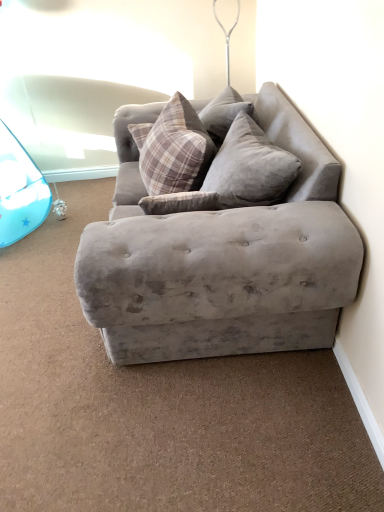
This screenshot has width=384, height=512. Describe the element at coordinates (250, 168) in the screenshot. I see `velvet gray pillow at center, acting as the second pillow starting from the left` at that location.

The image size is (384, 512). What do you see at coordinates (176, 150) in the screenshot?
I see `plaid fabric pillow at upper center, the first pillow from the left` at bounding box center [176, 150].

Locate an element on the screen. The height and width of the screenshot is (512, 384). velvet gray pillow at center, acting as the second pillow starting from the left is located at coordinates (250, 168).

Does velvet gray pillow at center, acting as the second pillow starting from the left, lie in front of plaid fabric pillow at upper center, the first pillow from the left?

Yes, it is in front of plaid fabric pillow at upper center, the first pillow from the left.

Visually, is velvet gray pillow at center, acting as the second pillow starting from the left, positioned to the left or to the right of plaid fabric pillow at upper center, which ranks as the 2th pillow in right-to-left order?

velvet gray pillow at center, acting as the second pillow starting from the left, is to the right of plaid fabric pillow at upper center, which ranks as the 2th pillow in right-to-left order.

Is velvet gray pillow at center, positioned as the first pillow in right-to-left order, looking in the opposite direction of plaid fabric pillow at upper center, which ranks as the 2th pillow in right-to-left order?

No.

Are velvet gray pillow at center, acting as the second pillow starting from the left, and plaid fabric pillow at upper center, which ranks as the 2th pillow in right-to-left order, making contact?

velvet gray pillow at center, acting as the second pillow starting from the left, and plaid fabric pillow at upper center, which ranks as the 2th pillow in right-to-left order, are not in contact.

Considering the relative positions of velvet gray pillow at center, acting as the second pillow starting from the left, and velvet gray couch at center in the image provided, is velvet gray pillow at center, acting as the second pillow starting from the left, behind velvet gray couch at center?

Yes, it is behind velvet gray couch at center.

Which of these two, velvet gray pillow at center, positioned as the first pillow in right-to-left order, or velvet gray couch at center, is wider?

With larger width is velvet gray couch at center.

How different are the orientations of velvet gray pillow at center, acting as the second pillow starting from the left, and velvet gray couch at center in degrees?

There is a 3.6-degree angle between the facing directions of velvet gray pillow at center, acting as the second pillow starting from the left, and velvet gray couch at center.

How far apart are velvet gray pillow at center, positioned as the first pillow in right-to-left order, and velvet gray couch at center?

10.79 inches.

Is velvet gray couch at center wider or thinner than plaid fabric pillow at upper center, which ranks as the 2th pillow in right-to-left order?

In the image, velvet gray couch at center appears to be wider than plaid fabric pillow at upper center, which ranks as the 2th pillow in right-to-left order.

Is the position of velvet gray couch at center less distant than that of plaid fabric pillow at upper center, which ranks as the 2th pillow in right-to-left order?

Yes, velvet gray couch at center is in front of plaid fabric pillow at upper center, which ranks as the 2th pillow in right-to-left order.

Is velvet gray couch at center taller or shorter than plaid fabric pillow at upper center, the first pillow from the left?

Considering their sizes, velvet gray couch at center has more height than plaid fabric pillow at upper center, the first pillow from the left.

From the image's perspective, is velvet gray couch at center located above or below plaid fabric pillow at upper center, the first pillow from the left?

Based on their image positions, velvet gray couch at center is located beneath plaid fabric pillow at upper center, the first pillow from the left.

Can you confirm if plaid fabric pillow at upper center, the first pillow from the left, is wider than velvet gray couch at center?

In fact, plaid fabric pillow at upper center, the first pillow from the left, might be narrower than velvet gray couch at center.

Which is in front, plaid fabric pillow at upper center, which ranks as the 2th pillow in right-to-left order, or velvet gray couch at center?

velvet gray couch at center is more forward.

Which object is positioned more to the left, plaid fabric pillow at upper center, the first pillow from the left, or velvet gray couch at center?

plaid fabric pillow at upper center, the first pillow from the left.

From a real-world perspective, does plaid fabric pillow at upper center, the first pillow from the left, sit lower than velvet gray couch at center?

No, from a real-world perspective, plaid fabric pillow at upper center, the first pillow from the left, is not beneath velvet gray couch at center.

Could you tell me if velvet gray couch at center is turned towards velvet gray pillow at center, acting as the second pillow starting from the left?

Yes.

Who is bigger, velvet gray couch at center or velvet gray pillow at center, acting as the second pillow starting from the left?

With larger size is velvet gray couch at center.

Is velvet gray couch at center wider or thinner than velvet gray pillow at center, acting as the second pillow starting from the left?

Clearly, velvet gray couch at center has more width compared to velvet gray pillow at center, acting as the second pillow starting from the left.

Is point (272, 341) closer to viewer compared to point (225, 157)?

Yes.

Does plaid fabric pillow at upper center, the first pillow from the left, come behind velvet gray pillow at center, positioned as the first pillow in right-to-left order?

Yes.

Is plaid fabric pillow at upper center, which ranks as the 2th pillow in right-to-left order, placed right next to velvet gray pillow at center, acting as the second pillow starting from the left?

No, plaid fabric pillow at upper center, which ranks as the 2th pillow in right-to-left order, is not with velvet gray pillow at center, acting as the second pillow starting from the left.

How different are the orientations of plaid fabric pillow at upper center, the first pillow from the left, and velvet gray pillow at center, acting as the second pillow starting from the left, in degrees?

5.93e-05 degrees separate the facing orientations of plaid fabric pillow at upper center, the first pillow from the left, and velvet gray pillow at center, acting as the second pillow starting from the left.

Which is behind, point (189, 175) or point (238, 121)?

Point (238, 121)

Locate an element on the screen. This screenshot has height=512, width=384. pillow that appears on the right of plaid fabric pillow at upper center, which ranks as the 2th pillow in right-to-left order is located at coordinates (250, 168).

Image resolution: width=384 pixels, height=512 pixels. I want to click on studio couch lying below the velvet gray pillow at center, positioned as the first pillow in right-to-left order (from the image's perspective), so click(x=222, y=259).

Which object lies further to the anchor point velvet gray pillow at center, positioned as the first pillow in right-to-left order, velvet gray couch at center or plaid fabric pillow at upper center, the first pillow from the left?

Among the two, velvet gray couch at center is located further to velvet gray pillow at center, positioned as the first pillow in right-to-left order.

From the image, which object appears to be farther from velvet gray couch at center, plaid fabric pillow at upper center, which ranks as the 2th pillow in right-to-left order, or velvet gray pillow at center, positioned as the first pillow in right-to-left order?

plaid fabric pillow at upper center, which ranks as the 2th pillow in right-to-left order, lies further to velvet gray couch at center than the other object.

From the image, which object appears to be nearer to velvet gray couch at center, velvet gray pillow at center, positioned as the first pillow in right-to-left order, or plaid fabric pillow at upper center, which ranks as the 2th pillow in right-to-left order?

Based on the image, velvet gray pillow at center, positioned as the first pillow in right-to-left order, appears to be nearer to velvet gray couch at center.

Looking at the image, which one is located closer to plaid fabric pillow at upper center, the first pillow from the left, velvet gray couch at center or velvet gray pillow at center, positioned as the first pillow in right-to-left order?

velvet gray pillow at center, positioned as the first pillow in right-to-left order, is positioned closer to the anchor plaid fabric pillow at upper center, the first pillow from the left.

Which object lies nearer to the anchor point velvet gray pillow at center, acting as the second pillow starting from the left, plaid fabric pillow at upper center, which ranks as the 2th pillow in right-to-left order, or velvet gray couch at center?

plaid fabric pillow at upper center, which ranks as the 2th pillow in right-to-left order.

From the image, which object appears to be farther from plaid fabric pillow at upper center, which ranks as the 2th pillow in right-to-left order, velvet gray pillow at center, acting as the second pillow starting from the left, or velvet gray couch at center?

Among the two, velvet gray couch at center is located further to plaid fabric pillow at upper center, which ranks as the 2th pillow in right-to-left order.

Locate an element on the screen. The image size is (384, 512). pillow positioned between velvet gray couch at center and plaid fabric pillow at upper center, which ranks as the 2th pillow in right-to-left order, from near to far is located at coordinates (250, 168).